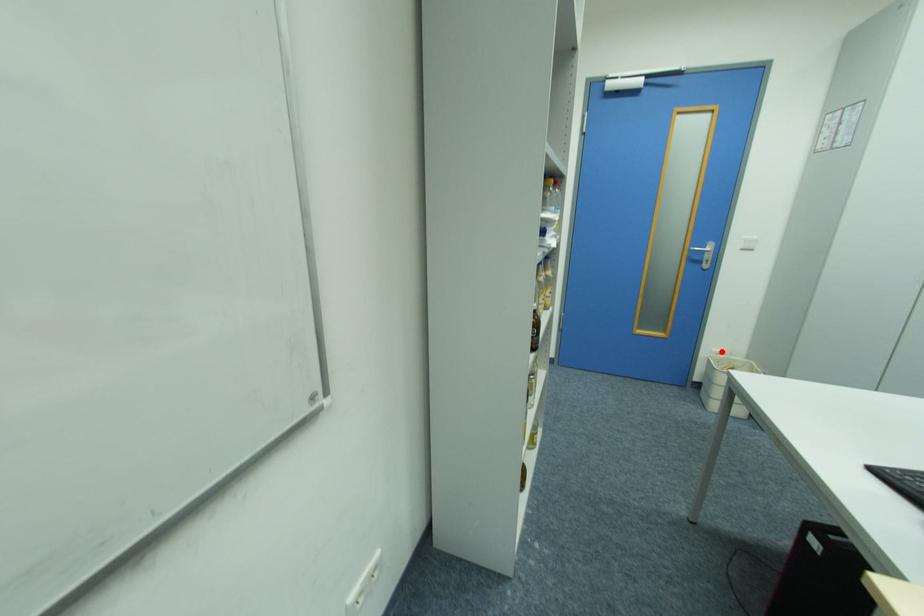
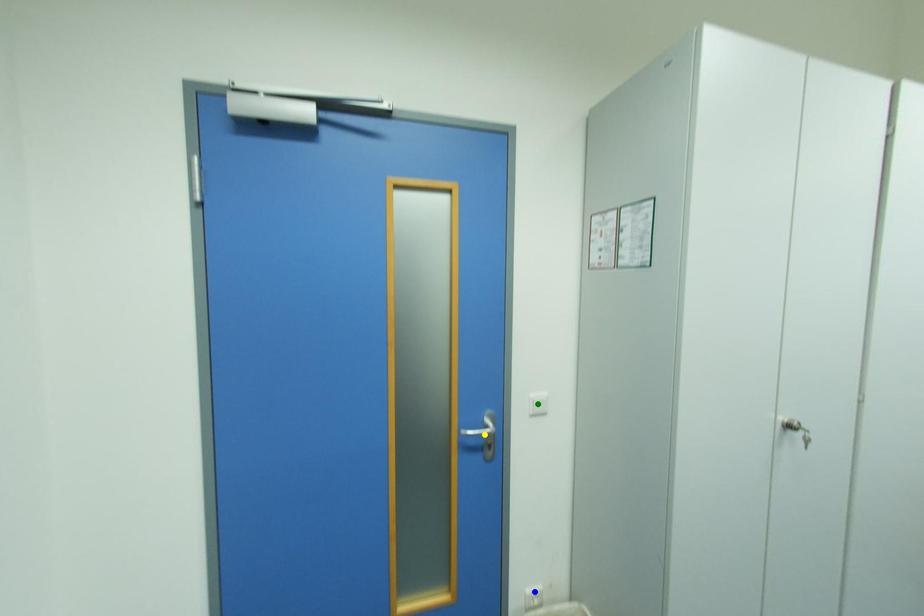
Question: I am providing you with two images of the same scene from different viewpoints. A red point is marked on the first image. You are given multiple points on the second image. Which point in image 2 is actually the same real-world point as the red point in image 1?

Choices:
 (A) green point
 (B) yellow point
 (C) blue point

Answer: (C)